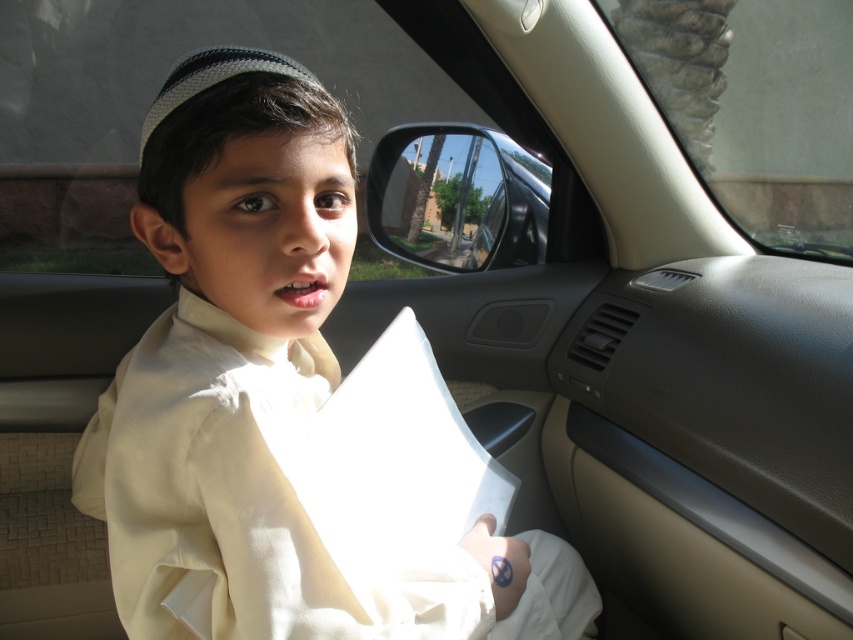
Which is in front, point (254, 339) or point (651, 3)?

Positioned in front is point (254, 339).

In the scene shown: Between white cotton robe at center and transparent glass car window at upper right, which one appears on the left side from the viewer's perspective?

white cotton robe at center

Which is in front, point (291, 560) or point (757, 36)?

Point (291, 560) is more forward.

You are a GUI agent. You are given a task and a screenshot of the screen. Output one action in this format:
    pyautogui.click(x=<x>, y=<y>)
    Task: Click on the white cotton robe at center
    
    Given the screenshot: What is the action you would take?
    pyautogui.click(x=270, y=508)

Is transparent glass car window at upper right above transparent glass mirror at center?

Yes.

Between point (734, 152) and point (454, 173), which one is positioned in front?

Positioned in front is point (454, 173).

Does point (642, 33) come farther from viewer compared to point (483, 195)?

Yes.

The width and height of the screenshot is (853, 640). Find the location of `transparent glass car window at upper right`. transparent glass car window at upper right is located at coordinates click(x=756, y=108).

Is white cotton robe at center thinner than transparent glass mirror at center?

No.

Does point (395, 632) come in front of point (457, 195)?

Yes, it is.

This screenshot has height=640, width=853. Find the location of `white cotton robe at center`. white cotton robe at center is located at coordinates (270, 508).